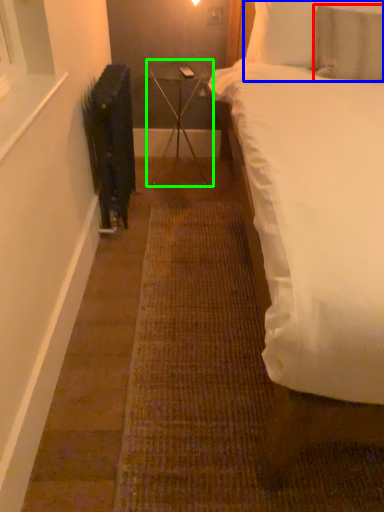
Question: Considering the real-world distances, which object is closest to pillow (highlighted by a red box)? pillow (highlighted by a blue box) or table (highlighted by a green box).

Choices:
 (A) pillow
 (B) table

Answer: (A)